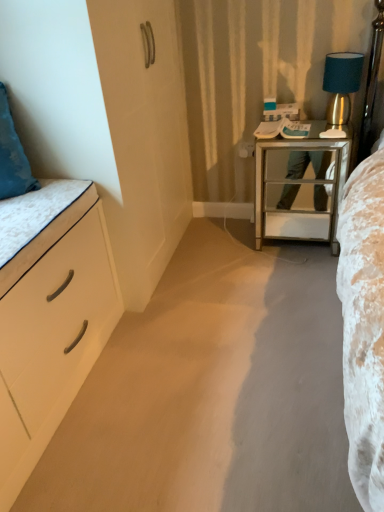
Question: From the image's perspective, is mirrored glass nightstand at center right above or below teal fabric lampshade at upper right?

Choices:
 (A) above
 (B) below

Answer: (B)

Question: From a real-world perspective, is mirrored glass nightstand at center right positioned above or below teal fabric lampshade at upper right?

Choices:
 (A) above
 (B) below

Answer: (B)

Question: Estimate the real-world distances between objects in this image. Which object is closer to the teal fabric lampshade at upper right?

Choices:
 (A) white matte drawer at left
 (B) white matte chest of drawers at left
 (C) mirrored glass nightstand at center right

Answer: (C)

Question: Which object is positioned closest to the mirrored glass nightstand at center right?

Choices:
 (A) white matte drawer at left
 (B) teal fabric lampshade at upper right
 (C) white matte chest of drawers at left

Answer: (B)